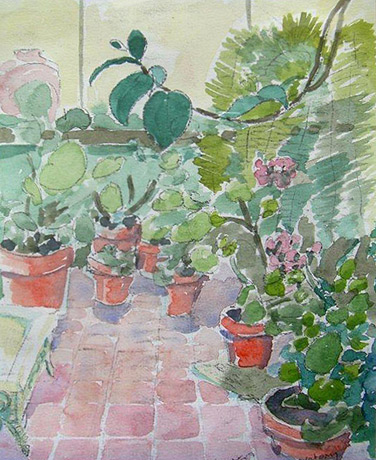
At what (x,y) coordinates should I click in order to perform the action: click on pot. Please return your answer as a coordinate pair (x, y). The height and width of the screenshot is (460, 376). Looking at the image, I should click on point(278,438).